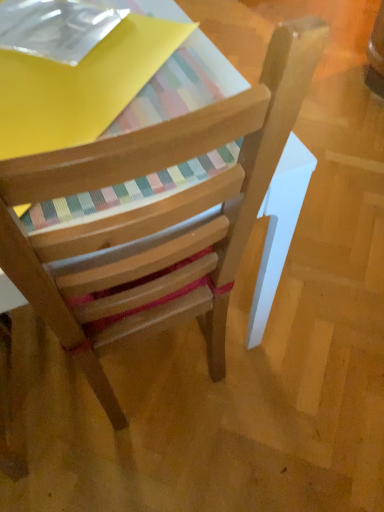
What is the approximate width of transparent plastic paperback book at upper left?

transparent plastic paperback book at upper left is 10.27 inches in width.

At what (x,y) coordinates should I click in order to perform the action: click on transparent plastic paperback book at upper left. Please return your answer as a coordinate pair (x, y). The image size is (384, 512). Looking at the image, I should click on (56, 27).

The height and width of the screenshot is (512, 384). What do you see at coordinates (56, 27) in the screenshot? I see `transparent plastic paperback book at upper left` at bounding box center [56, 27].

You are a GUI agent. You are given a task and a screenshot of the screen. Output one action in this format:
    pyautogui.click(x=<x>, y=<y>)
    Task: Click on the wooden chair at center
    The width and height of the screenshot is (384, 512).
    Given the screenshot: What is the action you would take?
    pyautogui.click(x=155, y=218)

This screenshot has width=384, height=512. What do you see at coordinates (155, 218) in the screenshot?
I see `wooden chair at center` at bounding box center [155, 218].

At what (x,y) coordinates should I click in order to perform the action: click on transparent plastic paperback book at upper left. Please return your answer as a coordinate pair (x, y). This screenshot has height=512, width=384. Looking at the image, I should click on click(x=56, y=27).

Considering the positions of objects transparent plastic paperback book at upper left and wooden chair at center in the image provided, who is more to the left, transparent plastic paperback book at upper left or wooden chair at center?

Positioned to the left is transparent plastic paperback book at upper left.

Considering the positions of objects transparent plastic paperback book at upper left and wooden chair at center in the image provided, who is in front, transparent plastic paperback book at upper left or wooden chair at center?

wooden chair at center is closer to the camera.

Which is less distant, (51, 48) or (251, 116)?

Point (51, 48).

From the image's perspective, does transparent plastic paperback book at upper left appear higher than wooden chair at center?

Yes, from the image's perspective, transparent plastic paperback book at upper left is over wooden chair at center.

From a real-world perspective, is transparent plastic paperback book at upper left located higher than wooden chair at center?

Indeed, from a real-world perspective, transparent plastic paperback book at upper left stands above wooden chair at center.

Which object is thinner, transparent plastic paperback book at upper left or wooden chair at center?

transparent plastic paperback book at upper left.

Who is taller, transparent plastic paperback book at upper left or wooden chair at center?

With more height is wooden chair at center.

Between transparent plastic paperback book at upper left and wooden chair at center, which one has larger size?

With larger size is wooden chair at center.

Is transparent plastic paperback book at upper left located outside wooden chair at center?

transparent plastic paperback book at upper left is positioned outside wooden chair at center.

Is the surface of transparent plastic paperback book at upper left in direct contact with wooden chair at center?

No, transparent plastic paperback book at upper left is not making contact with wooden chair at center.

Is transparent plastic paperback book at upper left oriented away from wooden chair at center?

That's not correct — transparent plastic paperback book at upper left is not looking away from wooden chair at center.

Consider the image. How different are the orientations of transparent plastic paperback book at upper left and wooden chair at center in degrees?

45.2 degrees.

Locate an element on the screen. chair in front of the transparent plastic paperback book at upper left is located at coordinates (155, 218).

Consider the image. Is wooden chair at center at the left side of transparent plastic paperback book at upper left?

No.

Who is more distant, wooden chair at center or transparent plastic paperback book at upper left?

transparent plastic paperback book at upper left is more distant.

Is point (24, 251) positioned in front of point (48, 39)?

Yes, point (24, 251) is closer to viewer.

From the image's perspective, would you say wooden chair at center is positioned over transparent plastic paperback book at upper left?

No, from the image's perspective, wooden chair at center is not over transparent plastic paperback book at upper left.

From a real-world perspective, between wooden chair at center and transparent plastic paperback book at upper left, who is vertically higher?

In real-world perspective, transparent plastic paperback book at upper left is above.

Which object is wider, wooden chair at center or transparent plastic paperback book at upper left?

wooden chair at center.

In the scene shown: Does wooden chair at center have a lesser height compared to transparent plastic paperback book at upper left?

In fact, wooden chair at center may be taller than transparent plastic paperback book at upper left.

Can you confirm if wooden chair at center is smaller than transparent plastic paperback book at upper left?

No, wooden chair at center is not smaller than transparent plastic paperback book at upper left.

Can transparent plastic paperback book at upper left be found inside wooden chair at center?

No, wooden chair at center does not contain transparent plastic paperback book at upper left.

Is the surface of wooden chair at center in direct contact with transparent plastic paperback book at upper left?

They are not placed beside each other.

Is wooden chair at center oriented away from transparent plastic paperback book at upper left?

wooden chair at center does not have its back to transparent plastic paperback book at upper left.

How many degrees apart are the facing directions of wooden chair at center and transparent plastic paperback book at upper left?

They differ by 45.2 degrees in their facing directions.

The height and width of the screenshot is (512, 384). I want to click on paperback book above the wooden chair at center (from the image's perspective), so click(56, 27).

In the image, there is a wooden chair at center. Where is `paperback book above it (from the image's perspective)`? paperback book above it (from the image's perspective) is located at coordinates (56, 27).

Identify the location of chair in front of the transparent plastic paperback book at upper left. (155, 218).